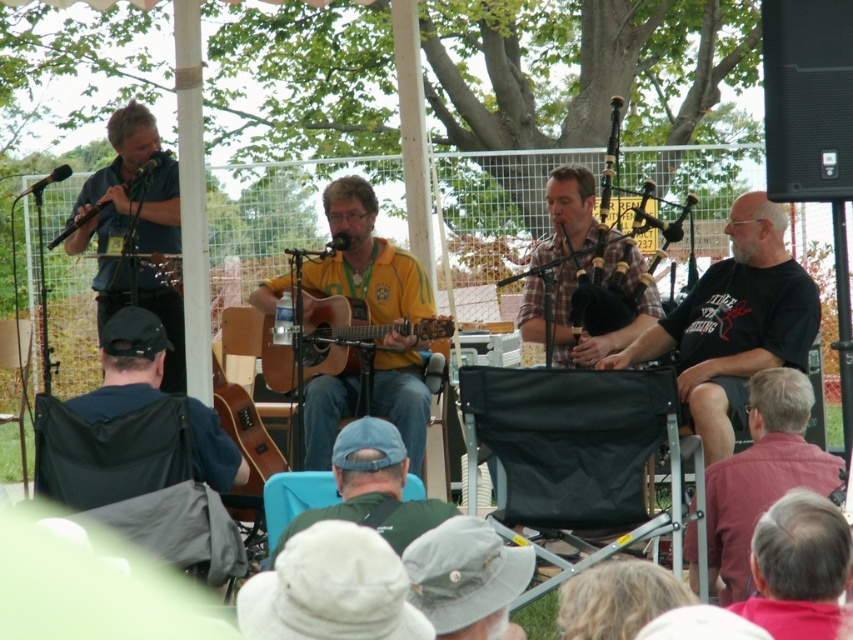
Question: Which point is closer to the camera?

Choices:
 (A) black cotton shirt at right
 (B) acoustic wood guitar at center
 (C) pink shirt at lower right

Answer: (C)

Question: Among these points, which one is farthest from the camera?

Choices:
 (A) [x=715, y=442]
 (B) [x=693, y=570]

Answer: (A)

Question: Is plaid fabric bagpipes at center to the right of wooden acoustic guitar at center from the viewer's perspective?

Choices:
 (A) no
 (B) yes

Answer: (B)

Question: Estimate the real-world distances between objects in this image. Which object is farther from the pink shirt at lower right?

Choices:
 (A) matte black microphone at left
 (B) acoustic wood guitar at center

Answer: (A)

Question: Is matte black microphone at left smaller than wooden acoustic guitar at center?

Choices:
 (A) no
 (B) yes

Answer: (A)

Question: Is yellow-green jersey at center wider than acoustic wood guitar at center?

Choices:
 (A) yes
 (B) no

Answer: (B)